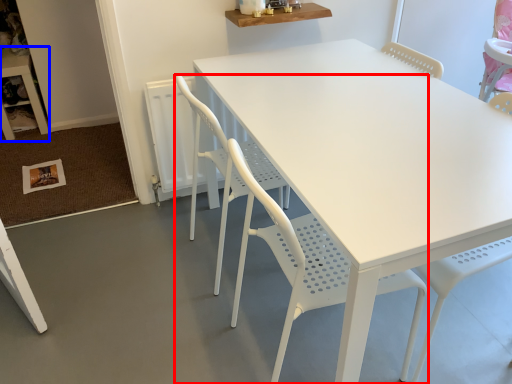
Question: Which object appears closest to the camera in this image, chair (highlighted by a red box) or table (highlighted by a blue box)?

Choices:
 (A) chair
 (B) table

Answer: (A)